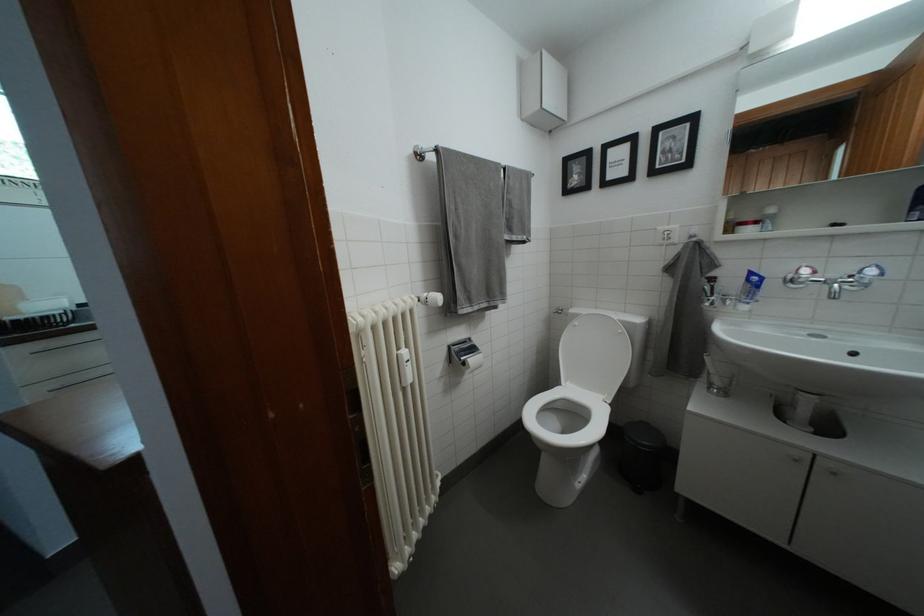
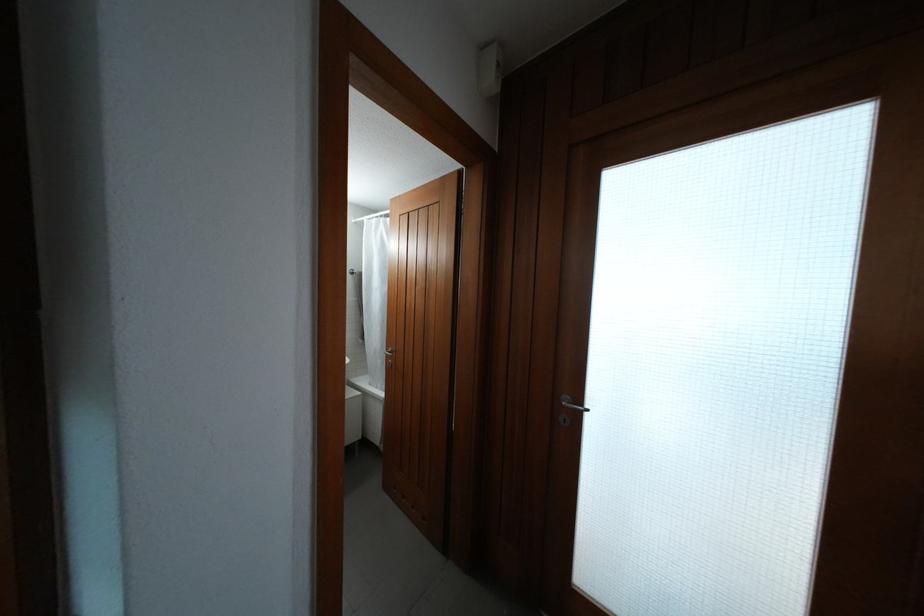
Question: The images are taken continuously from a first-person perspective. In which direction is your viewpoint rotating?

Choices:
 (A) Left
 (B) Right
 (C) Up
 (D) Down

Answer: (B)